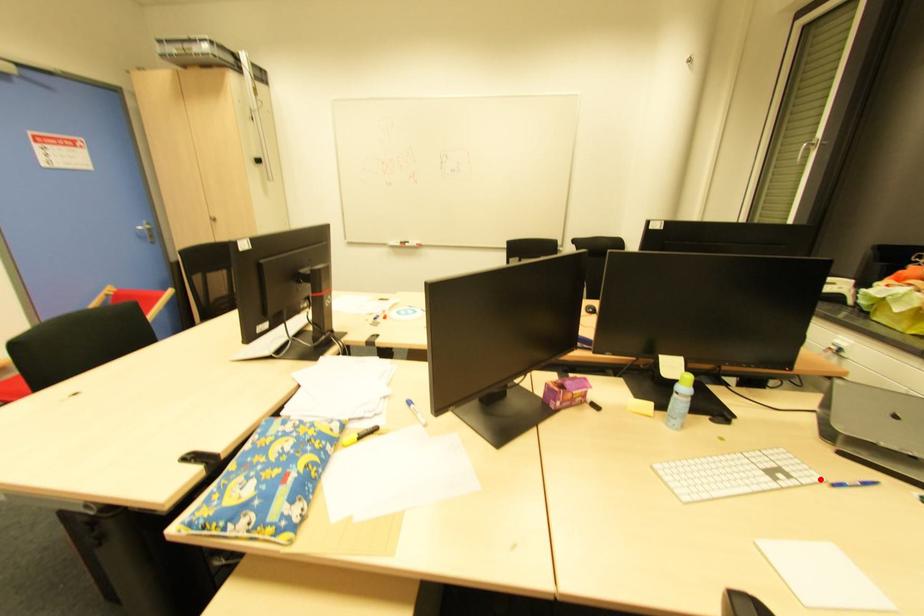
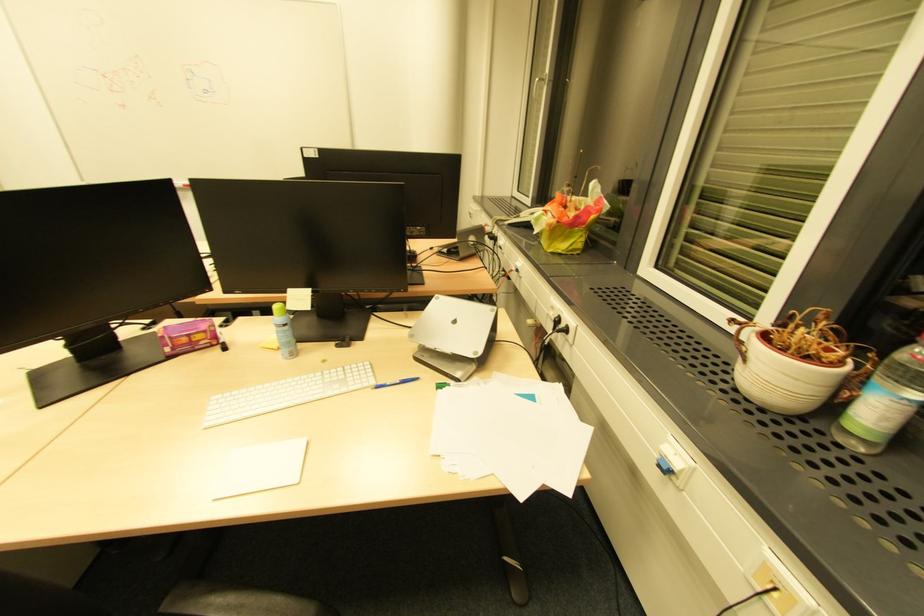
Question: I am providing you with two images of the same scene from different viewpoints. A red point is marked on the first image. Is the red point's position out of view in image 2?

Choices:
 (A) Yes
 (B) No

Answer: (B)